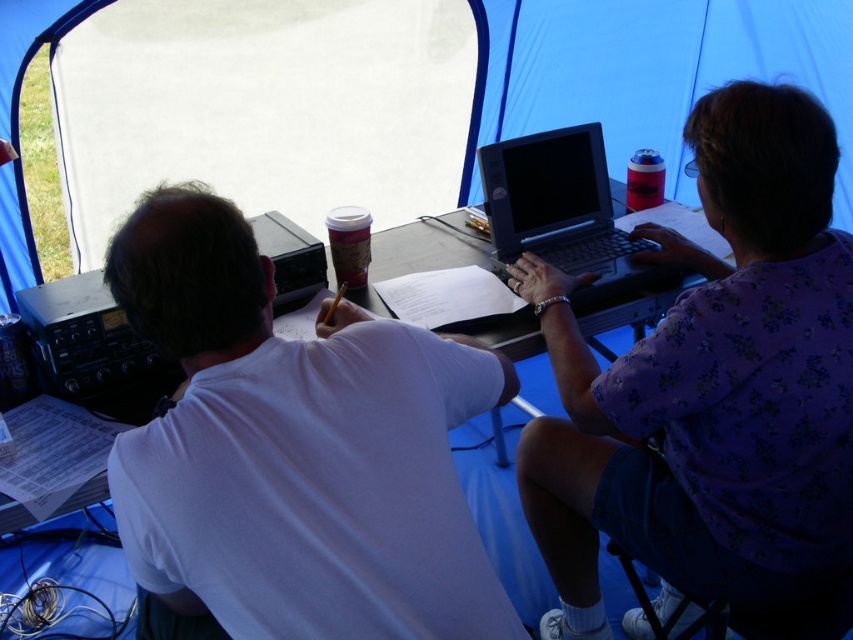
Is purple floral shirt at center positioned before blue fabric tent at upper center?

Yes, it is.

From the picture: Who is lower down, purple floral shirt at center or blue fabric tent at upper center?

purple floral shirt at center is lower down.

Is point (727, 266) closer to camera compared to point (730, 74)?

Yes, it is.

Locate an element on the screen. purple floral shirt at center is located at coordinates (711, 385).

Can you confirm if blue fabric tent at upper center is taller than matte plastic cup at upper right?

Yes.

Does blue fabric tent at upper center appear on the left side of matte plastic cup at upper right?

In fact, blue fabric tent at upper center is to the right of matte plastic cup at upper right.

Image resolution: width=853 pixels, height=640 pixels. I want to click on blue fabric tent at upper center, so coord(672,68).

Between point (195, 502) and point (16, 164), which one is positioned behind?

The point (16, 164) is behind.

Does white matte shirt at center appear under blue fabric tent at upper center?

Yes.

Where is `white matte shirt at center`? The image size is (853, 640). white matte shirt at center is located at coordinates (294, 449).